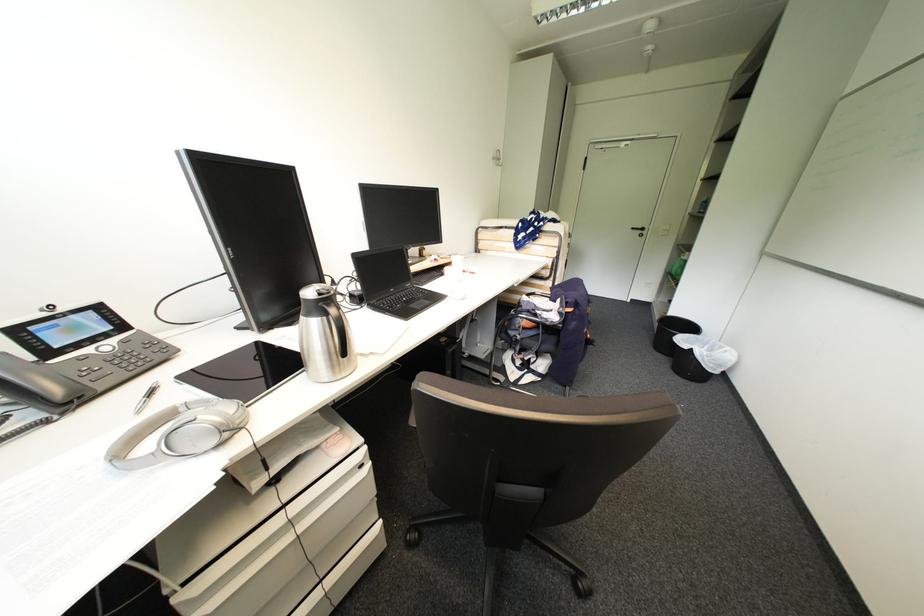
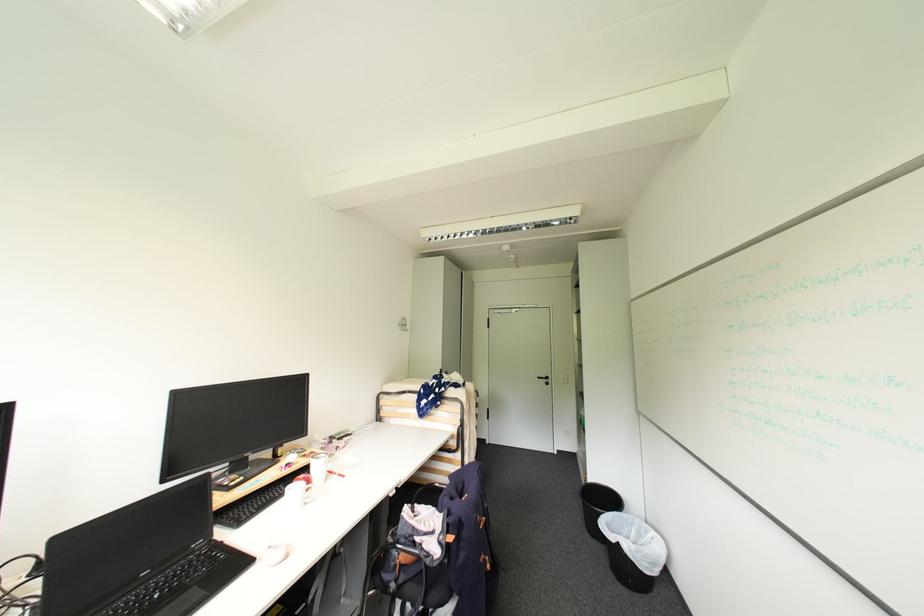
Find the pixel in the second image that matches pixel 475 274 in the first image.

(343, 477)